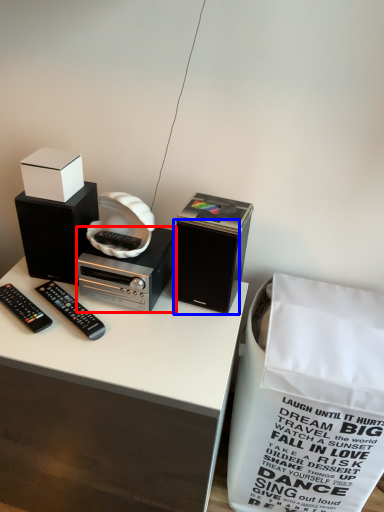
Question: Which object appears farthest to the camera in this image, cassette (highlighted by a red box) or speaker (highlighted by a blue box)?

Choices:
 (A) cassette
 (B) speaker

Answer: (A)